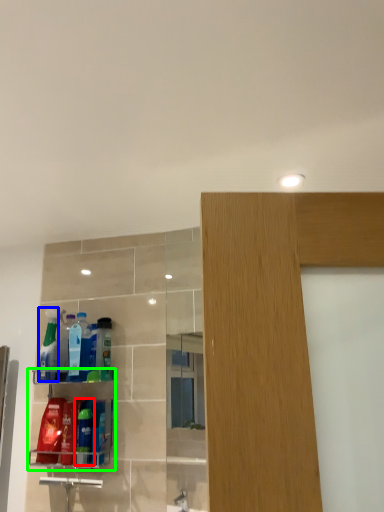
Question: Which is nearer to the cleaning product (highlighted by a red box)? cleaning product (highlighted by a blue box) or shelf (highlighted by a green box).

Choices:
 (A) cleaning product
 (B) shelf

Answer: (B)